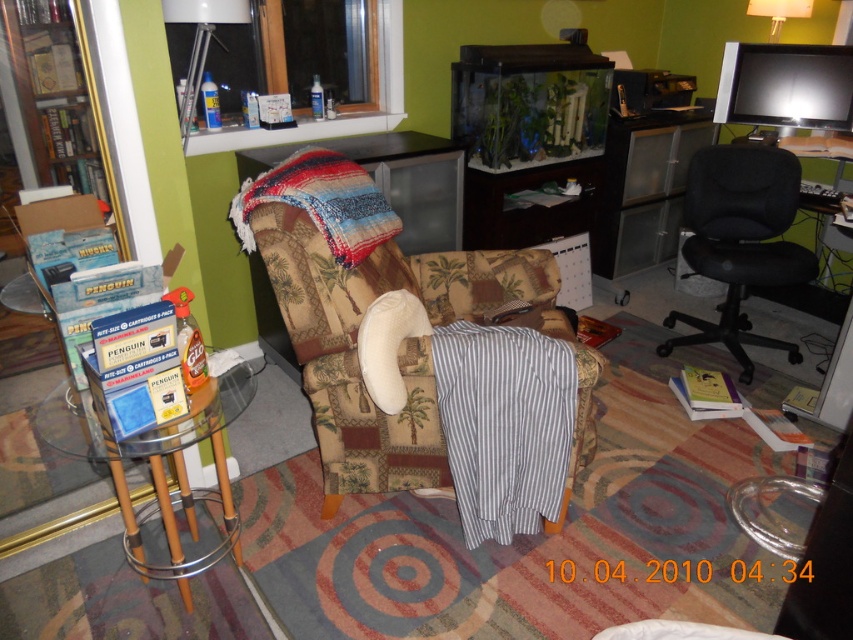
Question: Among these points, which one is farthest from the camera?

Choices:
 (A) (590, 371)
 (B) (755, 237)

Answer: (B)

Question: Which point appears farthest from the camera in this image?

Choices:
 (A) (286, 241)
 (B) (772, 154)
 (C) (30, 61)

Answer: (B)

Question: Can you confirm if patterned fabric couch at center is positioned above wooden bookshelf at left?

Choices:
 (A) no
 (B) yes

Answer: (A)

Question: Is patterned fabric couch at center closer to the viewer compared to black fabric swivel chair at right?

Choices:
 (A) yes
 (B) no

Answer: (A)

Question: Which of these objects is positioned closest to the wooden bookshelf at left?

Choices:
 (A) black fabric swivel chair at right
 (B) patterned fabric couch at center

Answer: (B)

Question: Is patterned fabric couch at center below wooden bookshelf at left?

Choices:
 (A) yes
 (B) no

Answer: (A)